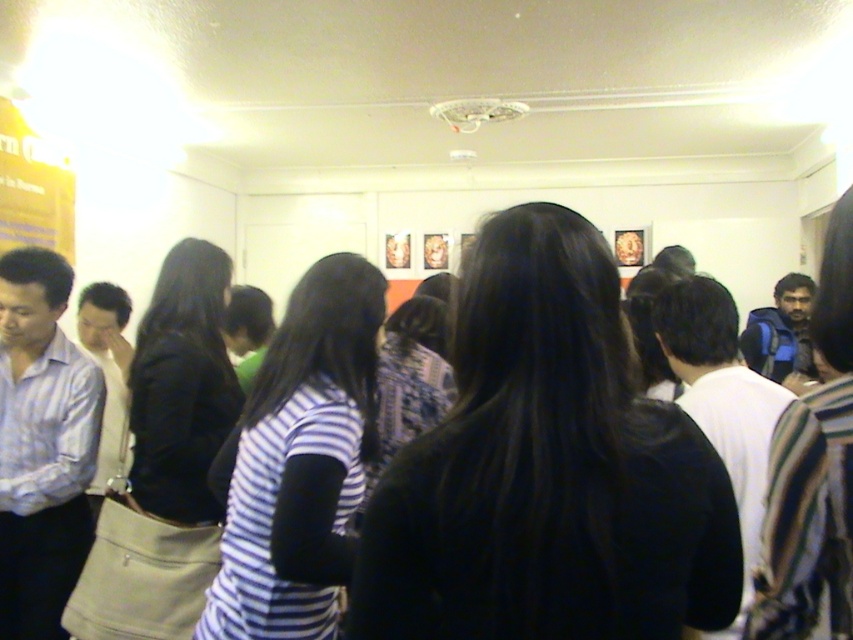
You are standing in the gallery and want to take a photo of the black matte hair at center and the matte black jacket at left. Which object should you focus on first to ensure both are in focus?

You should focus on the black matte hair at center first because it is closer to the viewer than the matte black jacket at left, so adjusting focus starting from the closer object ensures both can be in focus.

You are a photographer trying to capture a group photo of the striped fabric shirt at center and the matte black jacket at left. Since you want to ensure both subjects are fully visible, which subject requires a wider angle to accommodate their size?

The matte black jacket at left requires a wider angle because it is wider than the striped fabric shirt at center.